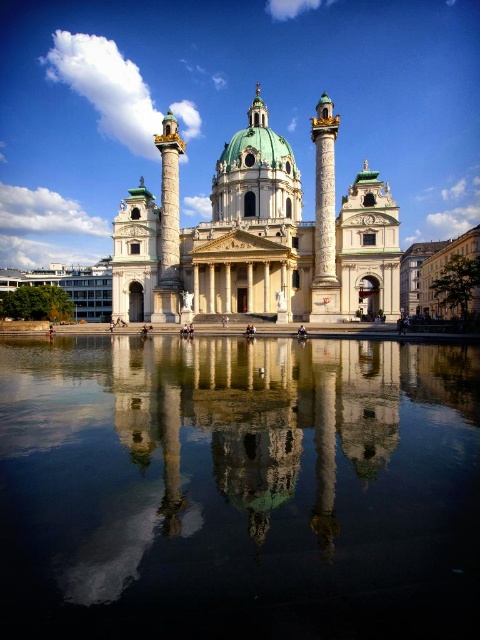
You are an architect analyzing the symmetry of the white marble church at center and the transparent glass water at center. Which object appears narrower when viewed from the front?

The transparent glass water at center appears narrower than the white marble church at center because it is thinner.

You are standing in front of the grand building and want to take a photo that includes both the point at coordinates point [29,400] and point [324,244]. Which point should you focus on first to ensure both are in focus?

You should focus on point [324,244] first because it is farther away from the camera than point [29,400], ensuring that both points will be within the depth of field.